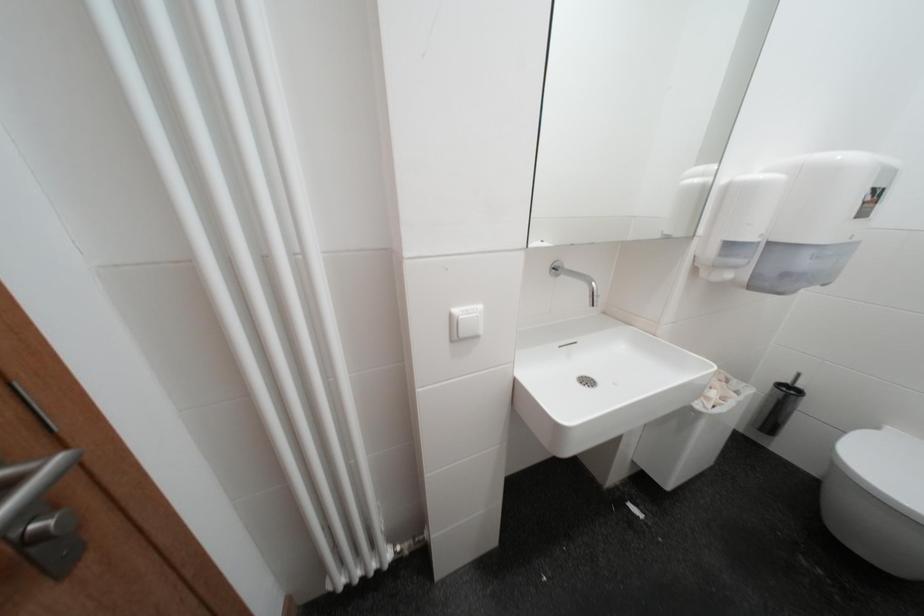
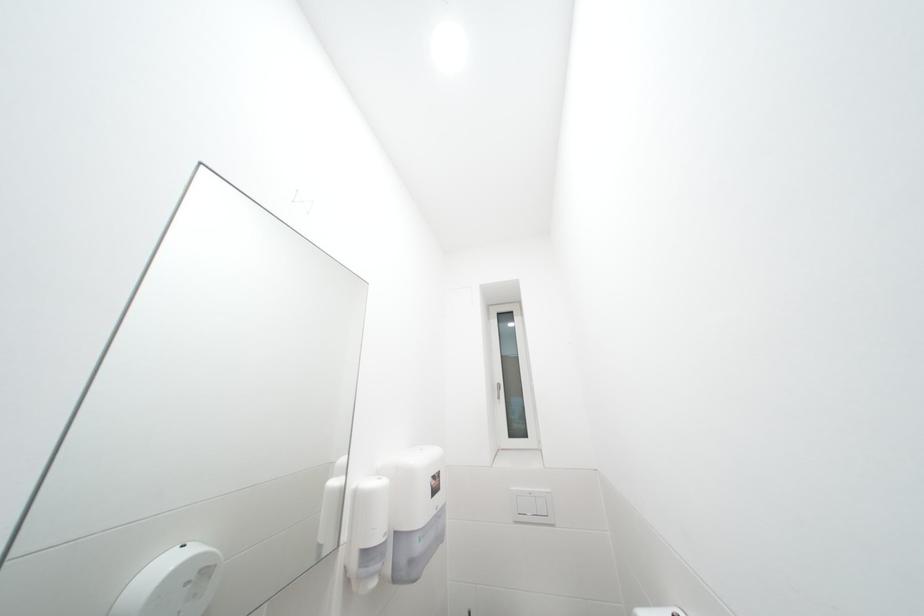
The first image is from the beginning of the video and the second image is from the end. How did the camera likely rotate when shooting the video?

The camera's rotation is toward right-up.